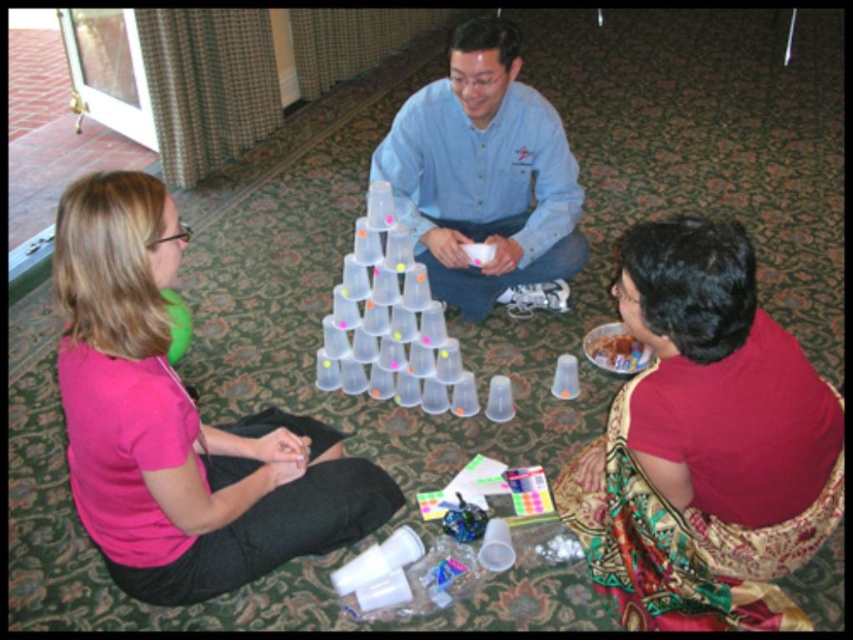
Is point (672, 429) positioned before point (86, 321)?

No, (672, 429) is behind (86, 321).

Looking at this image, between silky red saree at lower right and pink matte shirt at left, which one appears on the right side from the viewer's perspective?

From the viewer's perspective, silky red saree at lower right appears more on the right side.

The height and width of the screenshot is (640, 853). I want to click on silky red saree at lower right, so (705, 444).

Describe the element at coordinates (178, 422) in the screenshot. The width and height of the screenshot is (853, 640). I see `pink matte shirt at left` at that location.

Is point (160, 561) closer to camera compared to point (463, 84)?

Yes, point (160, 561) is in front of point (463, 84).

I want to click on pink matte shirt at left, so click(178, 422).

Who is taller, silky red saree at lower right or denim shirt at center?

Standing taller between the two is denim shirt at center.

Can you confirm if silky red saree at lower right is shorter than denim shirt at center?

Yes, silky red saree at lower right is shorter than denim shirt at center.

This screenshot has width=853, height=640. What are the coordinates of `silky red saree at lower right` in the screenshot? It's located at (705, 444).